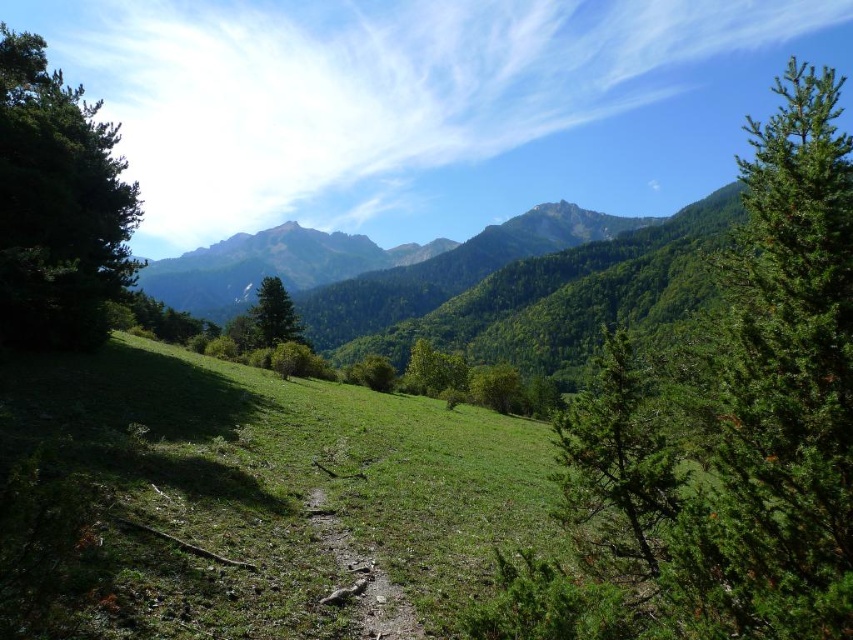
Question: Does green forested mountain at center have a larger size compared to dirt/gravel trail at center?

Choices:
 (A) no
 (B) yes

Answer: (B)

Question: Which point is closer to the camera?

Choices:
 (A) (648, 556)
 (B) (33, 237)
 (C) (474, 237)
 (D) (267, 316)

Answer: (A)

Question: Is green forested mountain at center to the right of dirt/gravel trail at center from the viewer's perspective?

Choices:
 (A) no
 (B) yes

Answer: (A)

Question: Does green matte tree at left lie behind green forested mountain at center?

Choices:
 (A) yes
 (B) no

Answer: (B)

Question: Which point is closer to the camera taking this photo?

Choices:
 (A) (811, 506)
 (B) (85, 160)

Answer: (A)

Question: Which point is closer to the camera taking this photo?

Choices:
 (A) (289, 332)
 (B) (726, 570)
 (C) (650, 552)
 (D) (338, 588)

Answer: (B)